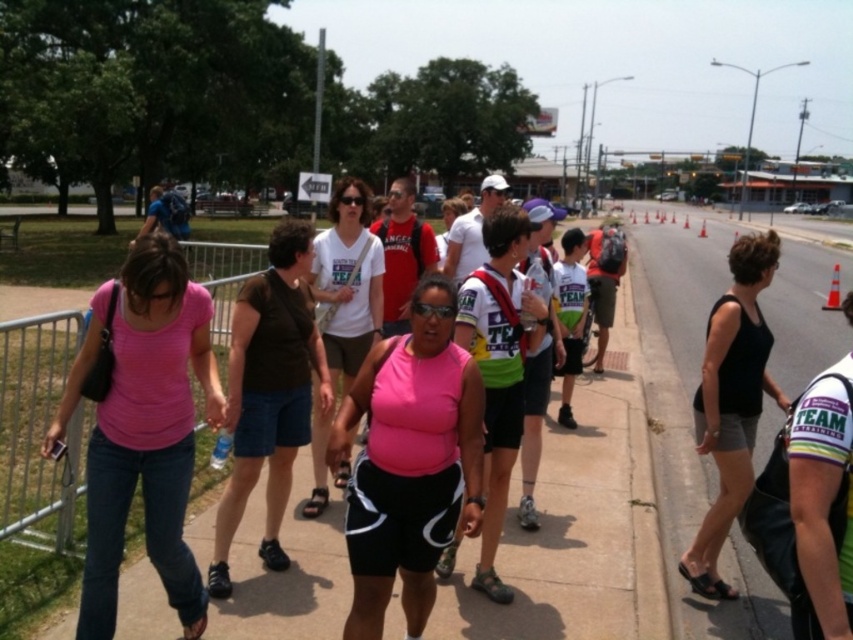
Question: Is pink matte tank top at center positioned in front of black tank top at right?

Choices:
 (A) yes
 (B) no

Answer: (A)

Question: Does pink matte shirt at center have a greater width compared to orange traffic cone at center-right?

Choices:
 (A) no
 (B) yes

Answer: (A)

Question: Which point appears closest to the camera in this image?

Choices:
 (A) (836, 284)
 (B) (761, 456)
 (C) (103, 557)
 (D) (701, 220)

Answer: (C)

Question: Which point appears closest to the camera in this image?

Choices:
 (A) (706, 422)
 (B) (838, 269)

Answer: (A)

Question: Does pink matte tank top at center appear under orange traffic cone at center-right?

Choices:
 (A) no
 (B) yes

Answer: (B)

Question: Which point is farther to the camera?

Choices:
 (A) (825, 305)
 (B) (167, 472)
 (C) (752, 236)
 (D) (618, 419)

Answer: (A)